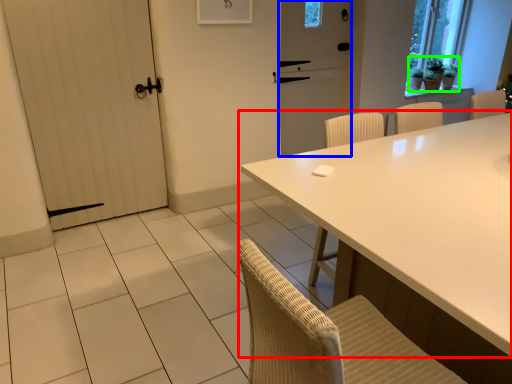
Question: Which is nearer to the table (highlighted by a red box)? screen door (highlighted by a blue box) or plant (highlighted by a green box).

Choices:
 (A) screen door
 (B) plant

Answer: (A)